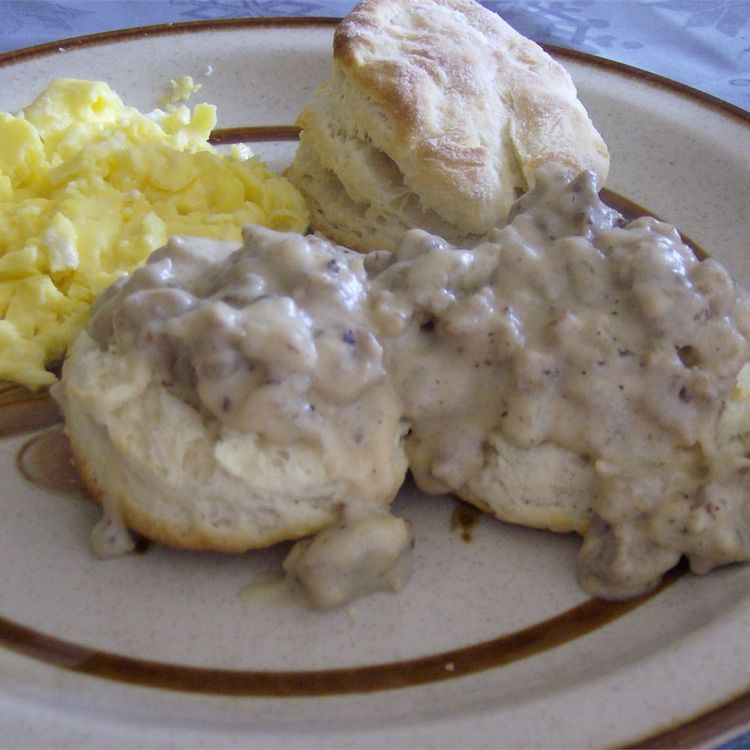
At what (x,y) coordinates should I click in order to perform the action: click on brown ring on dinner plate. Please return your answer as a coordinate pair (x, y). Looking at the image, I should click on (243, 682).